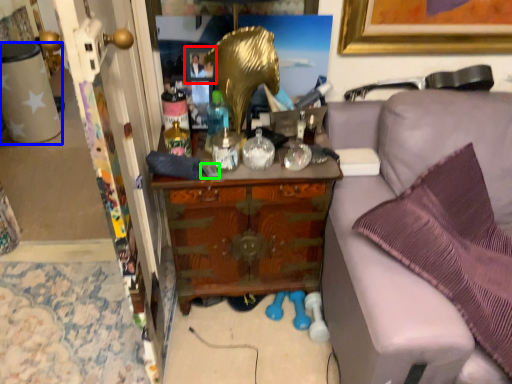
Question: Estimate the real-world distances between objects in this image. Which object is farther from picture frame (highlighted by a red box), desk (highlighted by a blue box) or remote control (highlighted by a green box)?

Choices:
 (A) desk
 (B) remote control

Answer: (A)